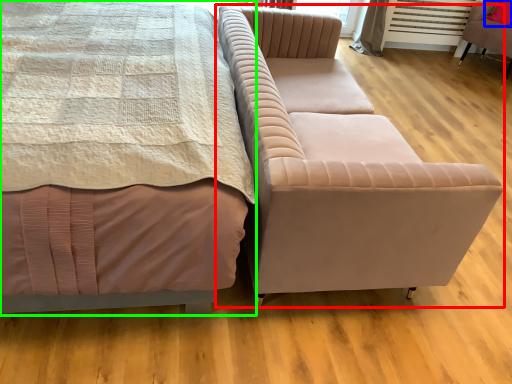
Question: Which object is positioned farthest from studio couch (highlighted by a red box)? Select from pillow (highlighted by a blue box) and bed (highlighted by a green box).

Choices:
 (A) pillow
 (B) bed

Answer: (A)